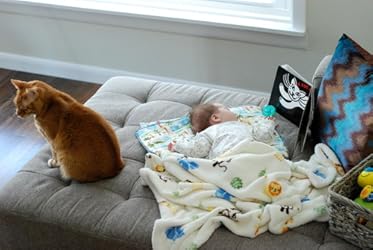
In order to click on basket of toys in this screenshot , I will do `click(339, 212)`.